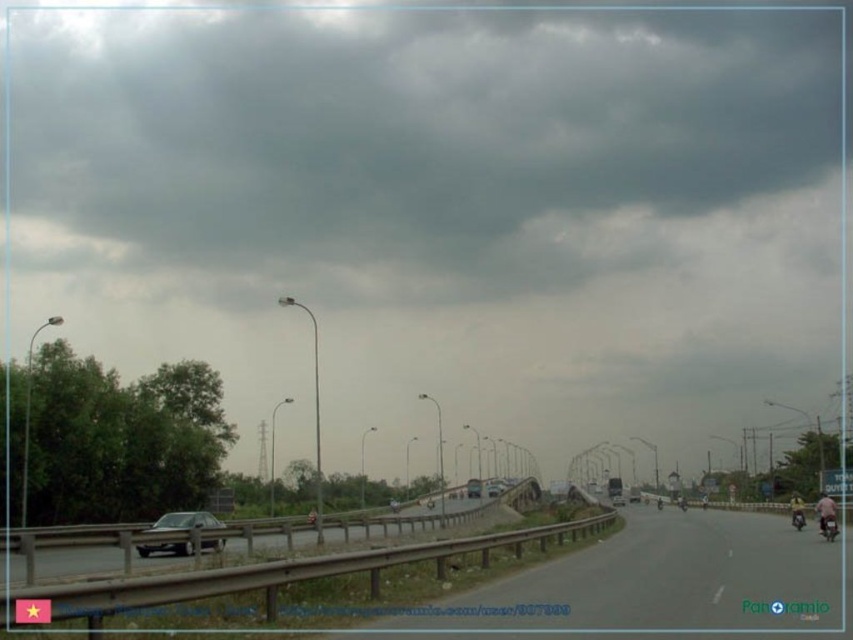
Question: Among these points, which one is farthest from the camera?

Choices:
 (A) (503, 488)
 (B) (204, 513)

Answer: (A)

Question: Is smooth asphalt highway at center bigger than shiny silver sedan at lower left?

Choices:
 (A) no
 (B) yes

Answer: (B)

Question: Which of the following is the farthest from the observer?

Choices:
 (A) metallic silver sedan at center
 (B) shiny silver sedan at lower left
 (C) asphalt road at center
 (D) smooth asphalt highway at center

Answer: (A)

Question: Which of the following is the closest to the observer?

Choices:
 (A) (611, 500)
 (B) (149, 529)
 (C) (495, 493)

Answer: (B)

Question: Observing the image, what is the correct spatial positioning of asphalt road at center in reference to shiny silver sedan at lower left?

Choices:
 (A) left
 (B) right

Answer: (B)

Question: Is asphalt road at center wider than metallic silver car at center?

Choices:
 (A) no
 (B) yes

Answer: (B)